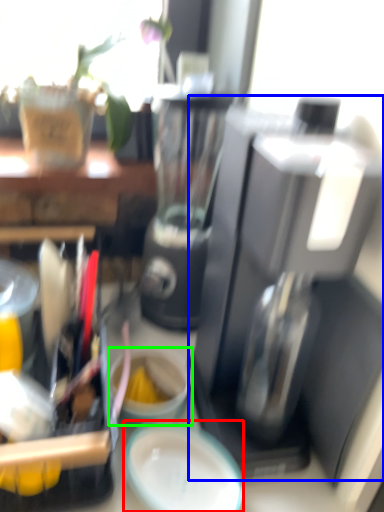
Question: Based on their relative distances, which object is nearer to plate (highlighted by a red box)? Choose from coffee maker (highlighted by a blue box) and coffee cup (highlighted by a green box).

Choices:
 (A) coffee maker
 (B) coffee cup

Answer: (B)